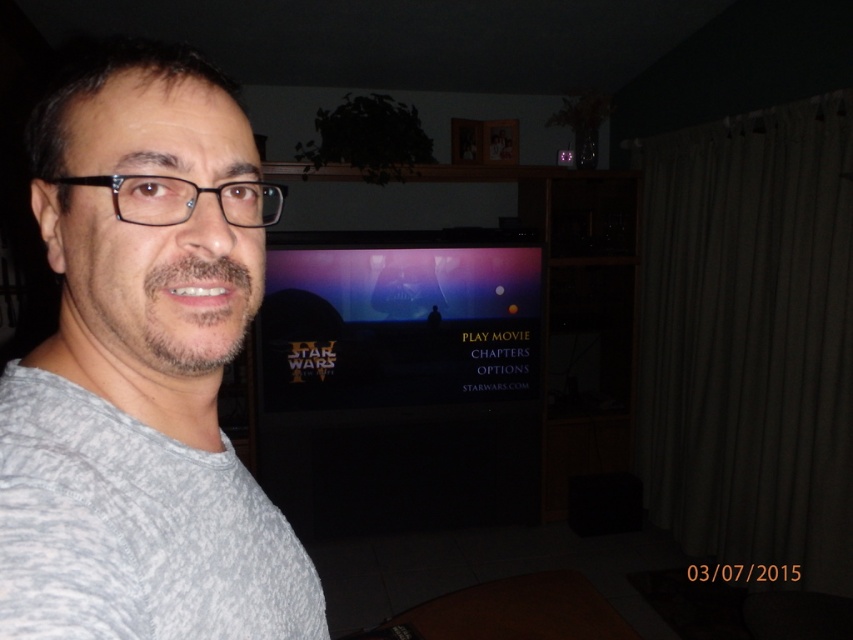
You are standing in the living room and want to take a photo of the black glossy tv at center. Since you are wearing the gray textured shirt at left, will the shirt be visible in the photo if you position yourself to the left of the TV?

Yes, the gray textured shirt at left will be visible in the photo because the black glossy tv at center is to the right of the gray textured shirt at left, so positioning yourself to the left of the TV would still allow the shirt to be in the frame.

You are a photographer trying to capture the man in the scene. Since the gray matte shirt at left and black glossy tv at center are in the frame, which object should you focus on to ensure the man is properly lit?

The gray matte shirt at left is smaller than the black glossy tv at center, so focusing on the larger black glossy tv at center would help ensure proper lighting for the man since it reflects more light.

The man in the image is taking a selfie in a dimly lit living room. He is wearing a gray, textured t shirt. There is a point at coordinates (143, 369). What object is located at that point?

The point at coordinates (143, 369) corresponds to the gray matte shirt at left.